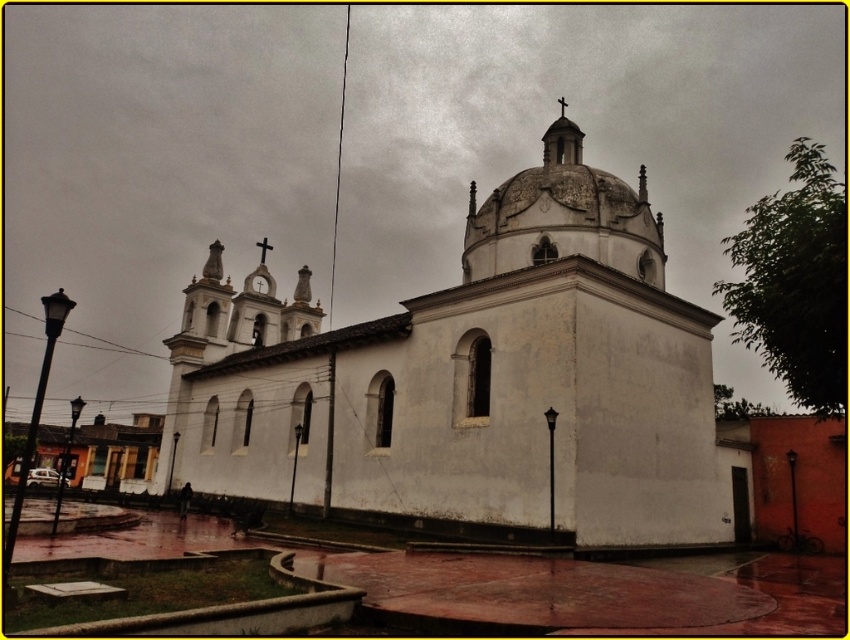
Based on the photo, is the position of white matte church at center less distant than that of white stone dome at upper center?

Yes, it is in front of white stone dome at upper center.

Is white matte church at center to the left of white stone dome at upper center from the viewer's perspective?

Indeed, white matte church at center is positioned on the left side of white stone dome at upper center.

Is point (575, 403) closer to camera compared to point (558, 141)?

Yes, it is in front of point (558, 141).

At what (x,y) coordinates should I click in order to perform the action: click on white matte church at center. Please return your answer as a coordinate pair (x, y). This screenshot has height=640, width=850. Looking at the image, I should click on (471, 378).